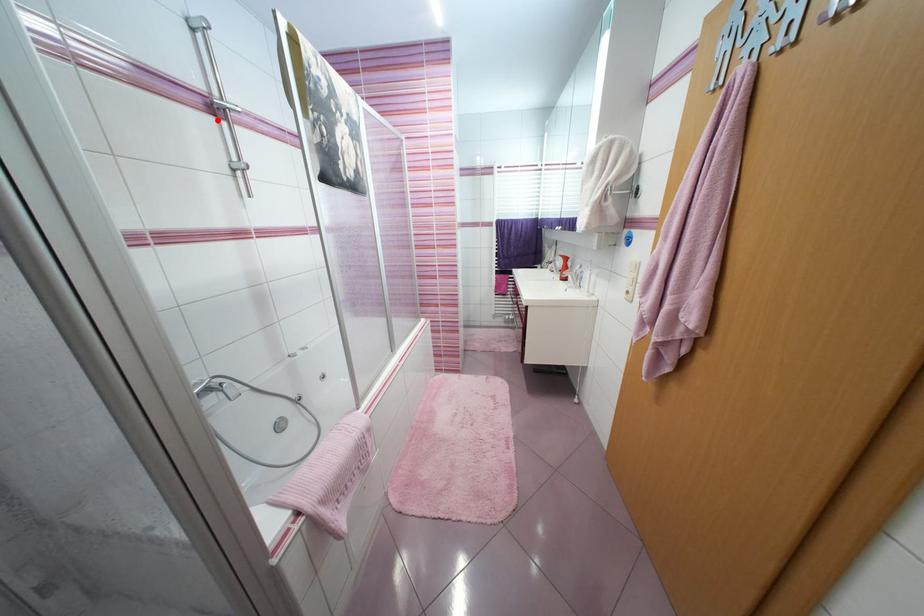
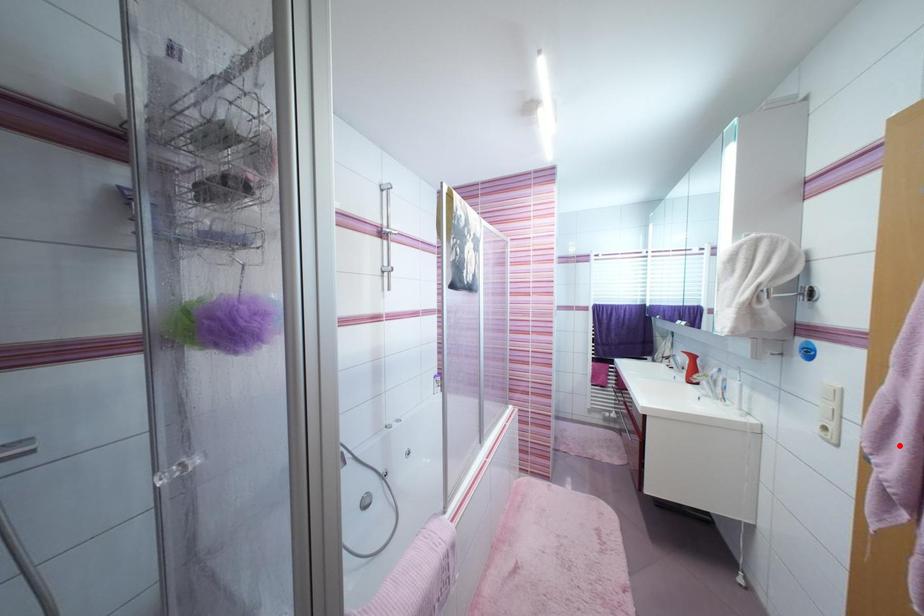
I am providing you with two images of the same scene from different viewpoints. A red point is marked on the first image and another point is marked on the second image. Is the red point in image1 aligned with the point shown in image2?

No